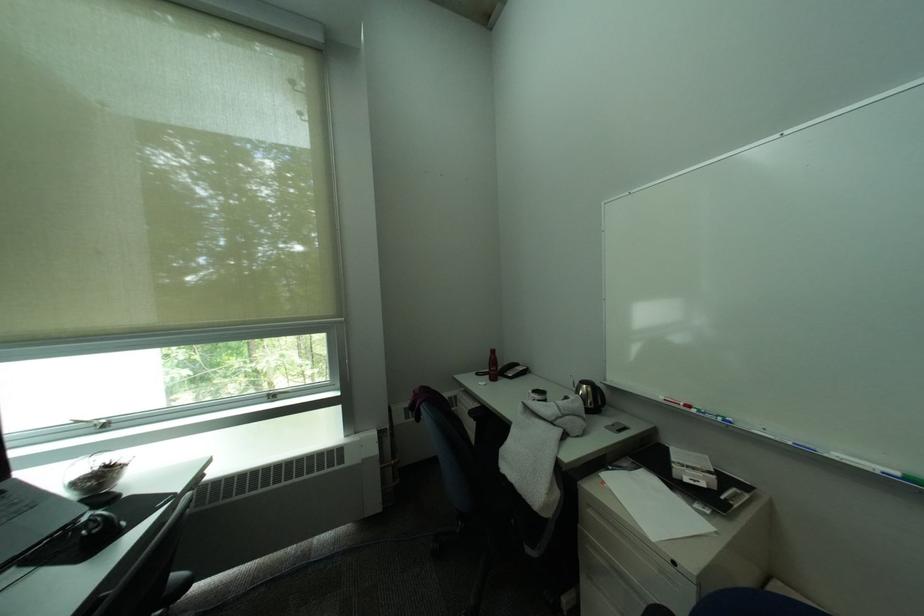
Where would you push the black computer mouse? Please return your answer as a coordinate pair (x, y).

(100, 528)